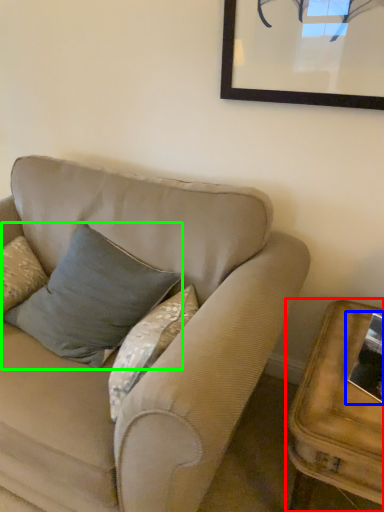
Question: Which object is positioned closest to table (highlighted by a red box)? Select from picture frame (highlighted by a blue box) and pillow (highlighted by a green box).

Choices:
 (A) picture frame
 (B) pillow

Answer: (A)